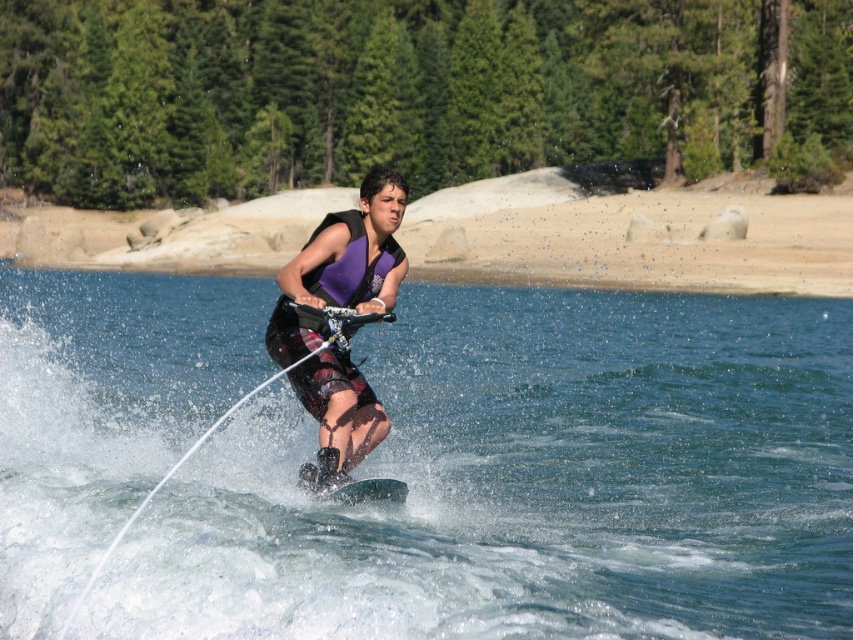
Question: Is green textured tree at upper center to the left of green smooth board at center from the viewer's perspective?

Choices:
 (A) no
 (B) yes

Answer: (A)

Question: Considering the real-world distances, which object is farthest from the clear blue water at center?

Choices:
 (A) purple matte life vest at center
 (B) green textured tree at upper center

Answer: (B)

Question: Estimate the real-world distances between objects in this image. Which object is farther from the purple matte life vest at center?

Choices:
 (A) green smooth board at center
 (B) clear blue water at center

Answer: (B)

Question: Can you confirm if clear blue water at center is bigger than green smooth board at center?

Choices:
 (A) yes
 (B) no

Answer: (A)

Question: Is green textured tree at upper center wider than green smooth board at center?

Choices:
 (A) yes
 (B) no

Answer: (A)

Question: Which point appears closest to the camera in this image?

Choices:
 (A) (346, 326)
 (B) (479, 518)

Answer: (A)